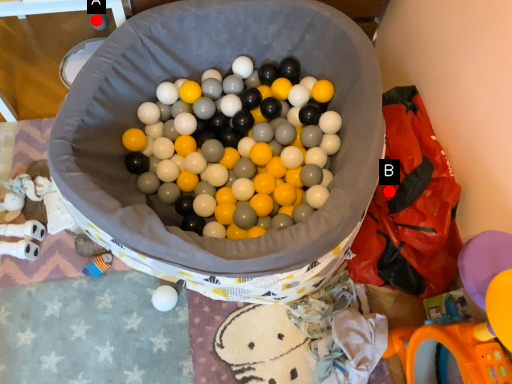
Question: Two points are circled on the image, labeled by A and B beside each circle. Among these points, which one is farthest from the camera?

Choices:
 (A) A is further
 (B) B is further

Answer: (A)